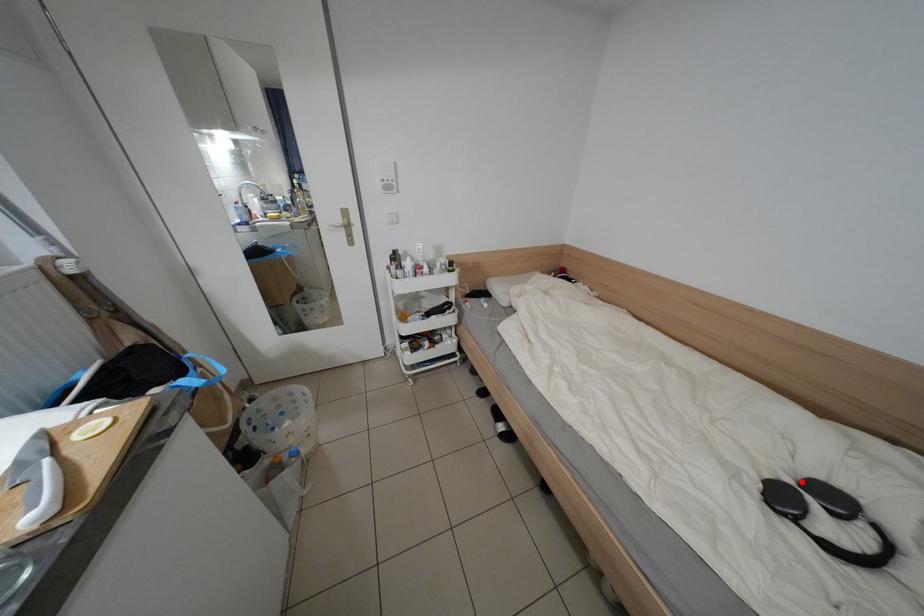
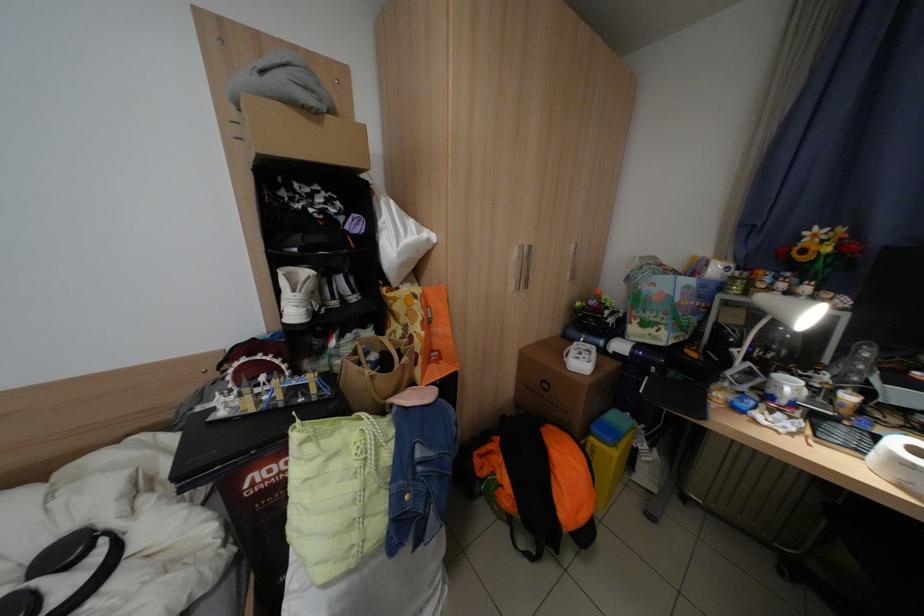
In the second image, find the point that corresponds to the highlighted location in the first image.

(17, 593)